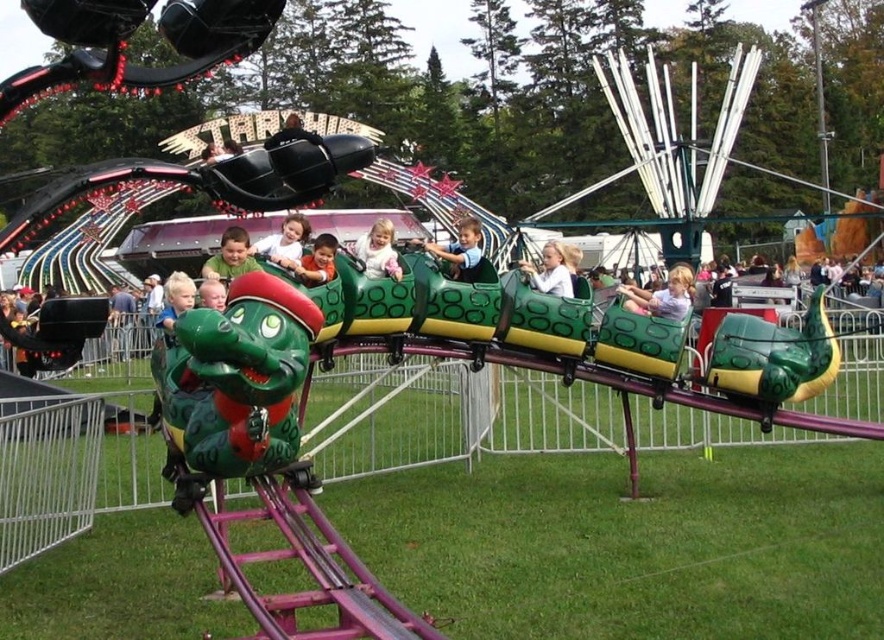
Question: Which of the following is the farthest from the observer?

Choices:
 (A) (219, 264)
 (B) (378, 262)
 (C) (477, 260)

Answer: (C)

Question: Which object is farther from the camera taking this photo?

Choices:
 (A) white matte dress at center
 (B) green matte dragon at center
 (C) matte green dragon at center
 (D) white matte shirt at center

Answer: (D)

Question: Which of the following is the closest to the observer?

Choices:
 (A) (538, 285)
 (B) (669, 301)
 (C) (385, 246)
 (D) (456, 257)

Answer: (C)

Question: Can you confirm if white matte shirt at center is positioned to the right of white matte dress at center?

Choices:
 (A) no
 (B) yes

Answer: (B)

Question: Does white matte shirt at center lie behind matte green dragon at center?

Choices:
 (A) yes
 (B) no

Answer: (A)

Question: Is light brown fabric shirt at center smaller than white matte shirt at center?

Choices:
 (A) no
 (B) yes

Answer: (A)